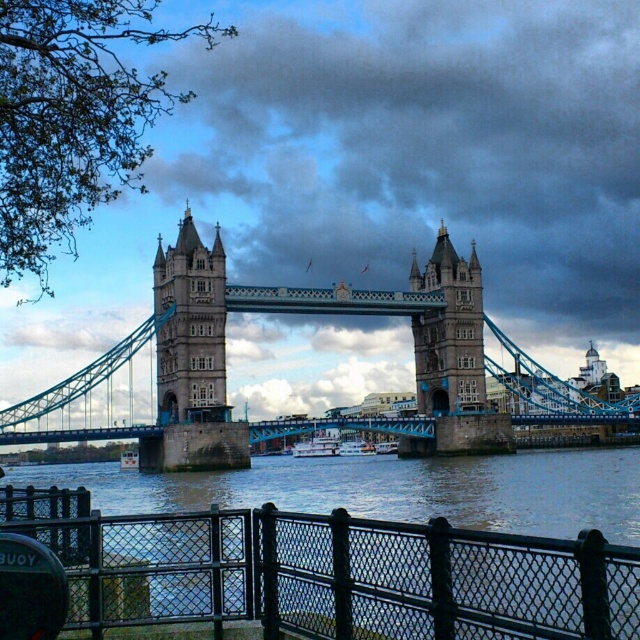
Does teal stone suspension bridge at center have a greater width compared to stone tower at center?

Indeed, teal stone suspension bridge at center has a greater width compared to stone tower at center.

The height and width of the screenshot is (640, 640). I want to click on teal stone suspension bridge at center, so click(304, 312).

Is teal stone suspension bridge at center bigger than stone stonework tower at center?

Correct, teal stone suspension bridge at center is larger in size than stone stonework tower at center.

Does point (97, 435) lie behind point (436, 289)?

That is False.

Between point (456, 381) and point (461, 328), which one is positioned behind?

The point (461, 328) is behind.

Image resolution: width=640 pixels, height=640 pixels. What are the coordinates of `teal stone suspension bridge at center` in the screenshot? It's located at (304, 312).

Which is more to the right, black metal fence at lower center or stone tower at center?

Positioned to the right is black metal fence at lower center.

Find the location of a particular element. black metal fence at lower center is located at coordinates (326, 572).

The image size is (640, 640). What are the coordinates of `black metal fence at lower center` in the screenshot? It's located at tap(326, 572).